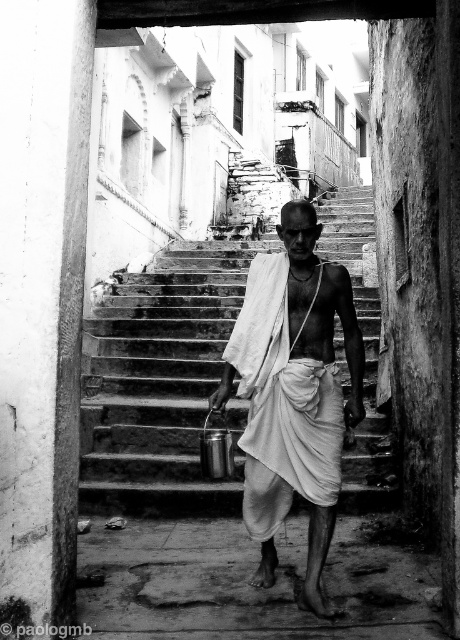
Can you confirm if stone stairs at center is wider than white clothed man at center?

Yes, stone stairs at center is wider than white clothed man at center.

Does point (339, 204) come farther from viewer compared to point (277, 368)?

Yes, it is.

Where is `stone stairs at center`? stone stairs at center is located at coordinates (161, 384).